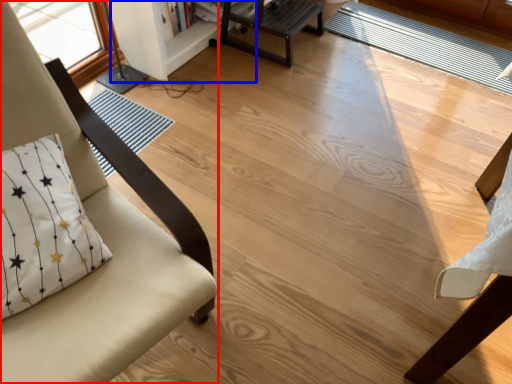
Question: Which object is further to the camera taking this photo, chair (highlighted by a red box) or bookshelf (highlighted by a blue box)?

Choices:
 (A) chair
 (B) bookshelf

Answer: (B)